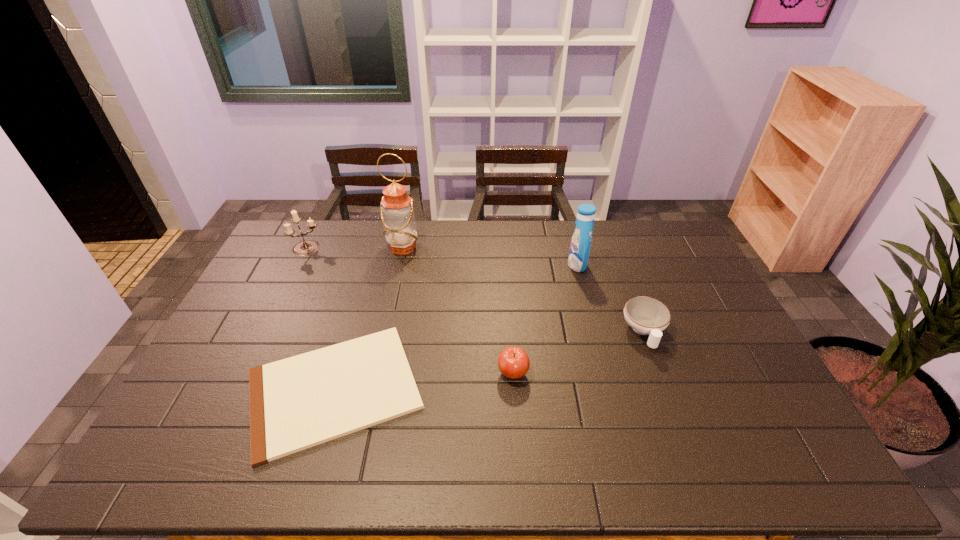
Find the location of `unoccupied position between the fourth object from left to right and the tallest object`. unoccupied position between the fourth object from left to right and the tallest object is located at coordinates (458, 310).

The image size is (960, 540). In order to click on object that is the third closest to the tallest object in this screenshot , I will do `click(581, 240)`.

Choose which object is the nearest neighbor to the third tallest object. Please provide its 2D coordinates. Your answer should be formatted as a tuple, i.e. [(x, y)], where the tuple contains the x and y coordinates of a point satisfying the conditions above.

[(397, 214)]